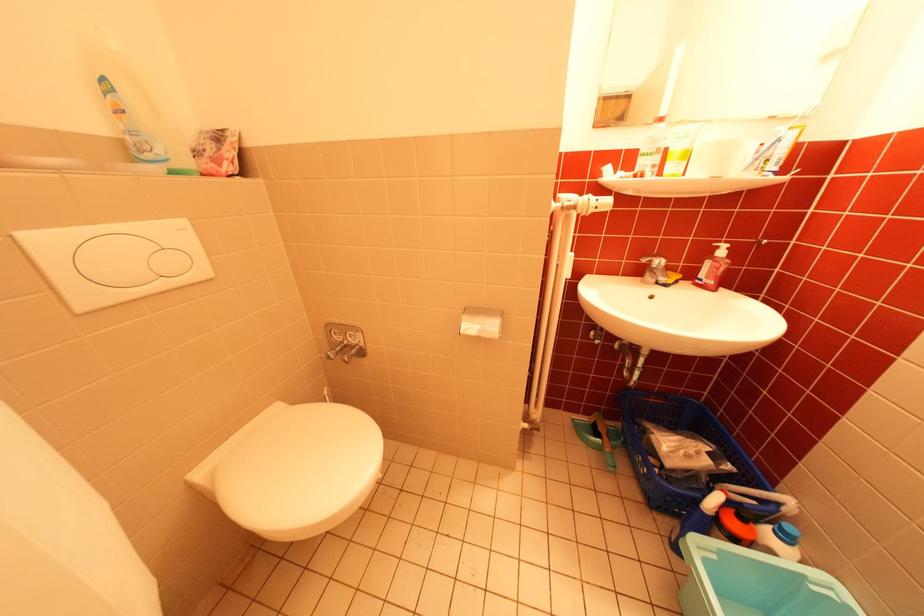
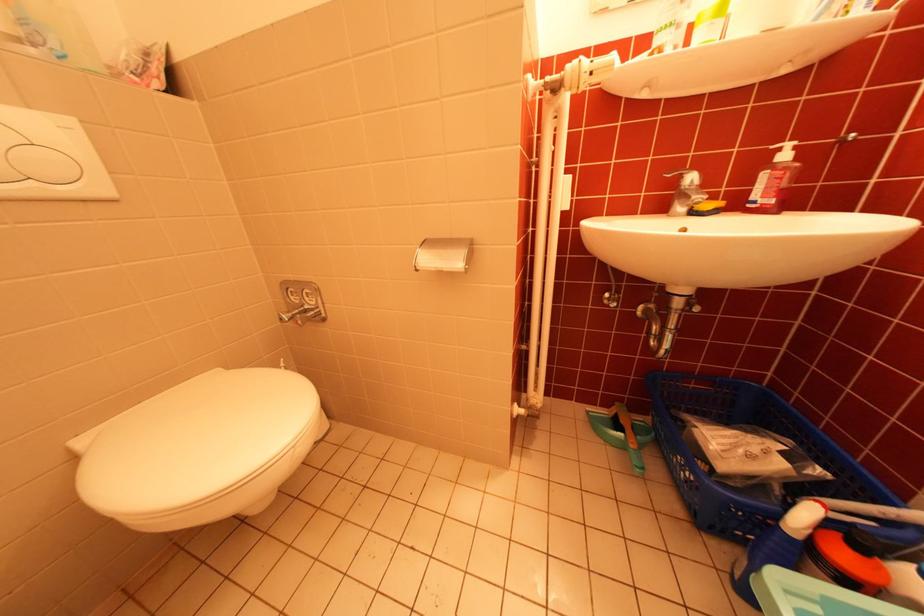
What movement of the cameraman would produce the second image?

The movement direction of the cameraman is right, forward.